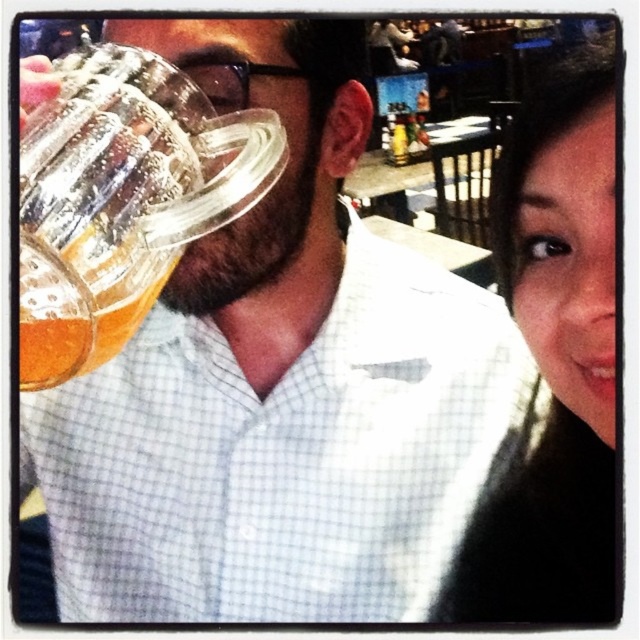
Is point (476, 554) positioned before point (22, 369)?

No, (476, 554) is behind (22, 369).

This screenshot has height=640, width=640. I want to click on black hair at upper right, so tap(554, 364).